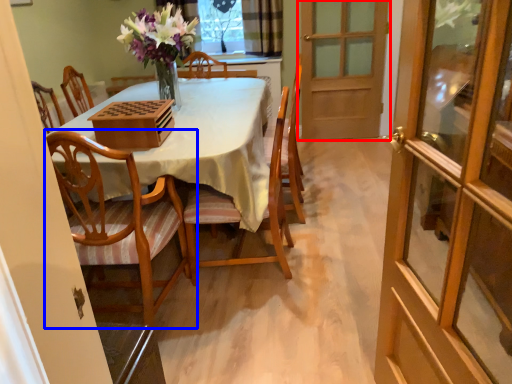
Question: Which point is closer to the camera, door (highlighted by a red box) or chair (highlighted by a blue box)?

Choices:
 (A) door
 (B) chair

Answer: (B)